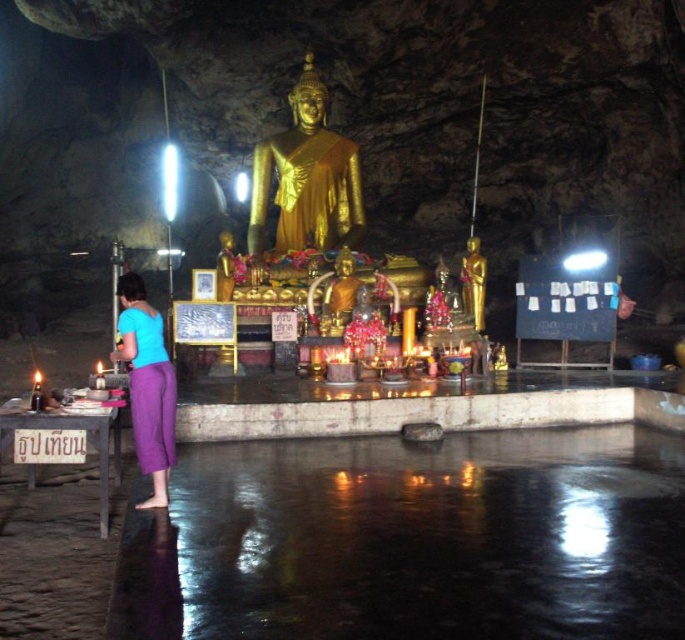
Question: Observing the image, what is the correct spatial positioning of purple cotton pants at lower left in reference to gold metallic statue at center?

Choices:
 (A) above
 (B) below

Answer: (B)

Question: Considering the relative positions of gold polished statue at center and gold shiny statue at center in the image provided, where is gold polished statue at center located with respect to gold shiny statue at center?

Choices:
 (A) left
 (B) right

Answer: (A)

Question: Which of the following is the farthest from the observer?

Choices:
 (A) gold polished statue at center
 (B) gold metallic statue at center
 (C) purple cotton pants at lower left
 (D) gold shiny statue at center

Answer: (A)

Question: Can you confirm if gold metallic statue at center is positioned above gold shiny statue at center?

Choices:
 (A) yes
 (B) no

Answer: (A)

Question: Which point is farther to the camera?

Choices:
 (A) (249, 237)
 (B) (477, 262)
 (C) (161, 340)
 (D) (323, 305)

Answer: (A)

Question: Estimate the real-world distances between objects in this image. Which object is farther from the gold metallic statue at center?

Choices:
 (A) gold polished statue at center
 (B) gold shiny statue at center

Answer: (A)